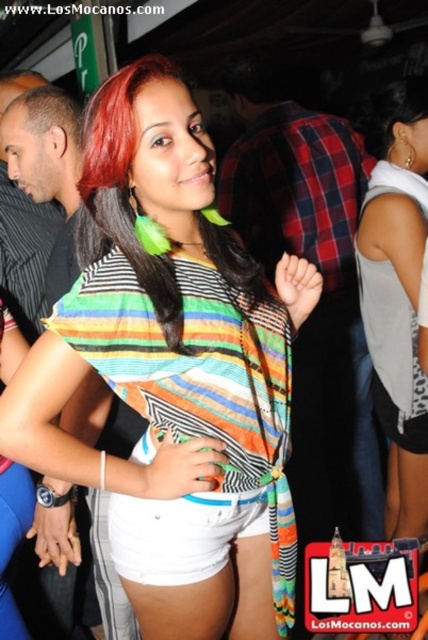
You are at a party and want to compare the clothing items of the central woman. Which clothing item, the plaid fabric shirt at center or the white fabric shorts at lower center, is wider?

The plaid fabric shirt at center is wider than the white fabric shorts at lower center according to the description.

You are at a party and want to take a photo of the multicolored fabric hair at center. Your camera has a minimum focus distance of 1 meter. Will you be able to focus on it?

The multicolored fabric hair at center is 92.08 centimeters away from the viewer, which is less than 1 meter. Therefore, the camera cannot focus on it because it is too close.

In the scene, there is a woman wearing a multicolored fabric scarf at center and has multicolored fabric hair at center. Which of these two items has a larger height?

The multicolored fabric scarf at center has a greater height compared to the multicolored fabric hair at center.